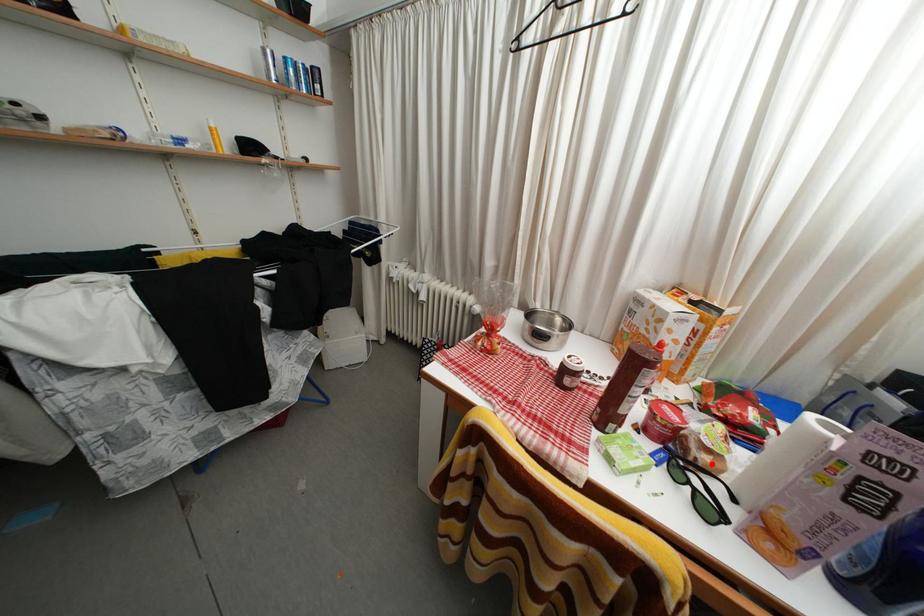
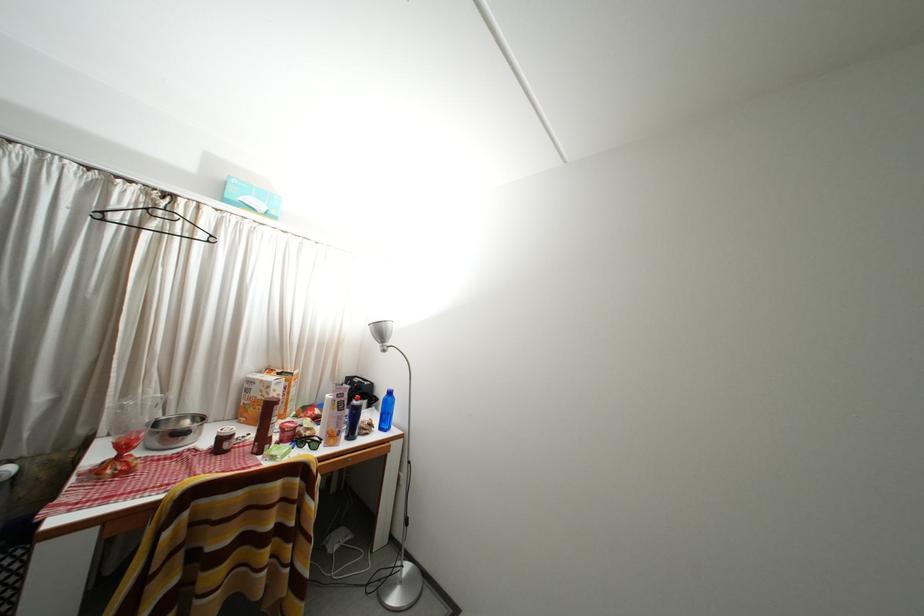
Question: I am providing you with two images of the same scene from different viewpoints. Image1 has a red point marked. In image2, the corresponding 3D location appears at what relative position? Reply with the corresponding letter.

Choices:
 (A) Closer
 (B) Farther

Answer: (B)